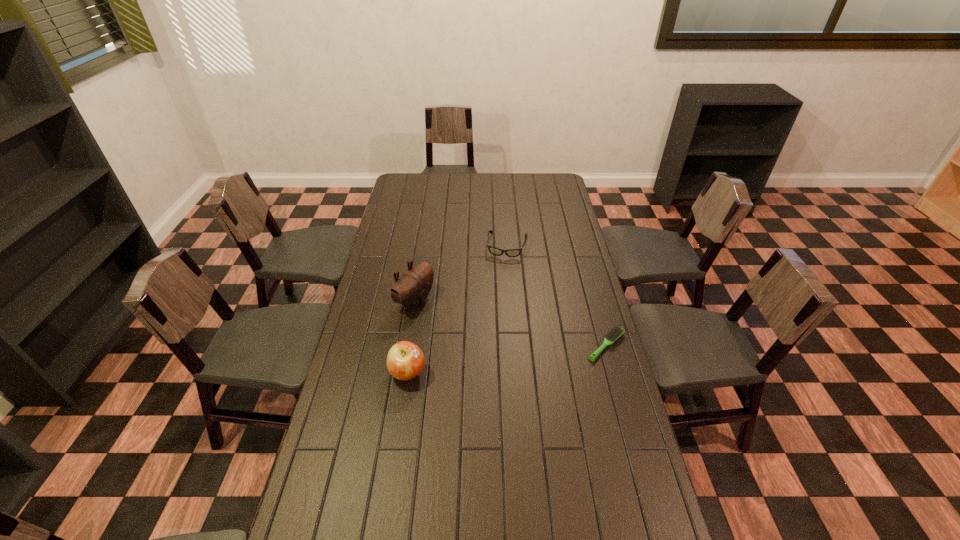
I want to click on the second tallest object, so click(x=405, y=360).

Image resolution: width=960 pixels, height=540 pixels. I want to click on hairbrush, so click(617, 331).

The image size is (960, 540). What are the coordinates of `the shortest object` in the screenshot? It's located at (617, 331).

I want to click on the third tallest object, so click(x=495, y=251).

Identify the location of spectacles. This screenshot has width=960, height=540. (495, 251).

In order to click on the third nearest object in this screenshot , I will do `click(411, 290)`.

Locate an element on the screen. pouch is located at coordinates (411, 290).

Where is `free space located on the back of the apple`? This screenshot has height=540, width=960. free space located on the back of the apple is located at coordinates (420, 287).

At what (x,y) coordinates should I click in order to perform the action: click on free space located on the front of the shortest object. Please return your answer as a coordinate pair (x, y). This screenshot has height=540, width=960. Looking at the image, I should click on (633, 440).

In order to click on vacant region located 0.050m on the front-facing side of the farthest object in this screenshot , I will do tap(503, 267).